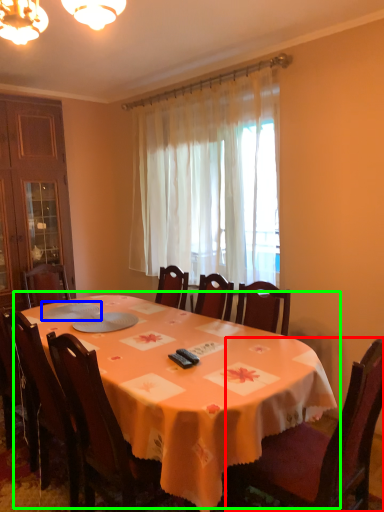
Question: Considering the real-world distances, which object is farthest from chair (highlighted by a red box)? tableware (highlighted by a blue box) or table (highlighted by a green box)?

Choices:
 (A) tableware
 (B) table

Answer: (A)